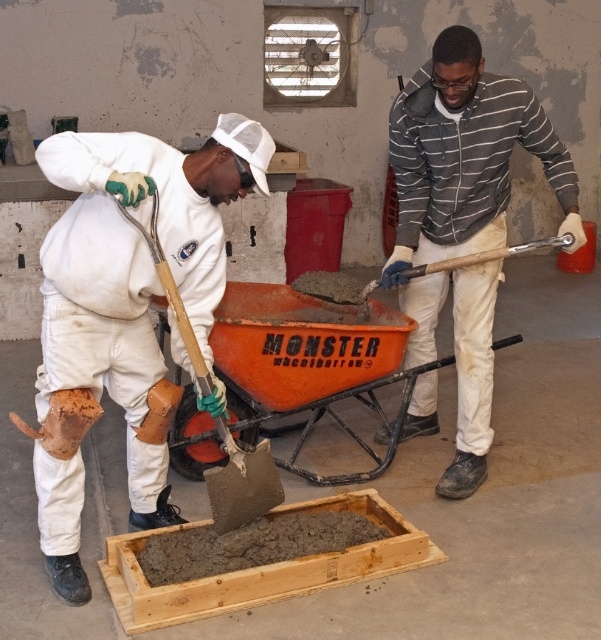
Question: Does orange plastic wheelbarrow at center have a larger size compared to smooth concrete shovel at center?

Choices:
 (A) yes
 (B) no

Answer: (A)

Question: Which is nearer to the smooth concrete shovel at center?

Choices:
 (A) wooden shovel at center
 (B) orange plastic wheelbarrow at center
 (C) white matte workwear at center

Answer: (B)

Question: Which of the following is the farthest from the observer?

Choices:
 (A) (44, 326)
 (B) (269, 481)
 (C) (287, 428)
 (D) (466, 330)

Answer: (C)

Question: Does white matte workwear at center appear on the right side of wooden shovel at center?

Choices:
 (A) no
 (B) yes

Answer: (A)

Question: Which point is closer to the camera?

Choices:
 (A) (135, 390)
 (B) (245, 435)

Answer: (A)

Question: Is white matte workwear at center below orange plastic wheelbarrow at center?

Choices:
 (A) yes
 (B) no

Answer: (B)